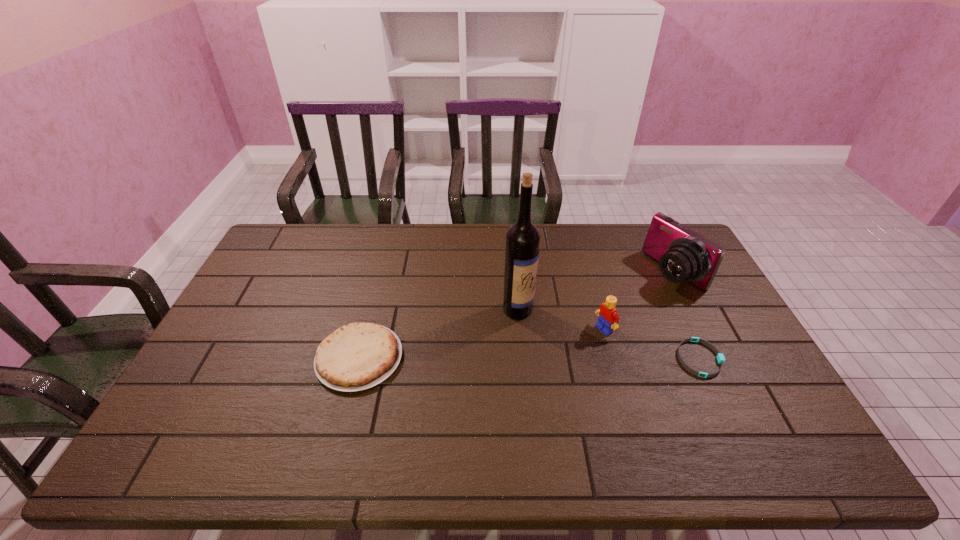
This screenshot has width=960, height=540. What are the coordinates of `the second shortest object` in the screenshot? It's located at [x=357, y=356].

Where is `tortilla`? The image size is (960, 540). tortilla is located at coordinates (357, 356).

Image resolution: width=960 pixels, height=540 pixels. I want to click on the shortest object, so click(x=720, y=357).

At what (x,y) coordinates should I click in order to perform the action: click on the third shortest object. Please return your answer as a coordinate pair (x, y). Looking at the image, I should click on (608, 318).

At what (x,y) coordinates should I click in order to perform the action: click on Lego. Please return your answer as a coordinate pair (x, y). Looking at the image, I should click on (608, 318).

At what (x,y) coordinates should I click in order to perform the action: click on the farthest object. Please return your answer as a coordinate pair (x, y). This screenshot has height=540, width=960. Looking at the image, I should click on (684, 255).

I want to click on camera, so click(684, 255).

Identify the location of the fourth object from right to left. (522, 238).

The width and height of the screenshot is (960, 540). Identify the location of wine bottle. (522, 238).

Locate an element on the screen. The height and width of the screenshot is (540, 960). free space located 0.220m on the back of the tortilla is located at coordinates (380, 278).